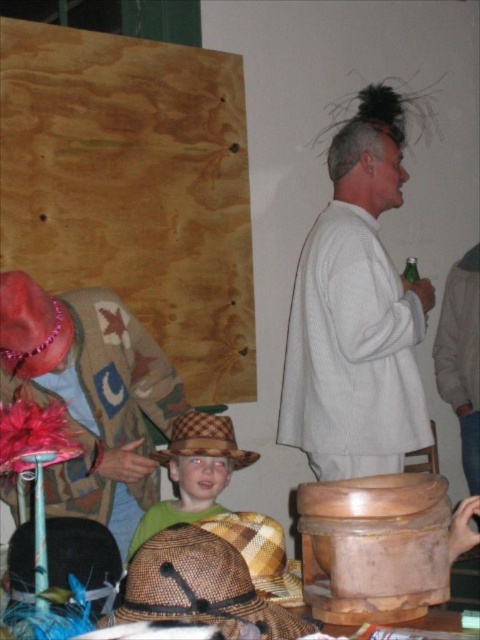
You are a fashion designer observing the image. You notice the knitted wool sweater at center and the woven straw cowboy hat at center. Which item is covering the other?

The knitted wool sweater at center is positioned over the woven straw cowboy hat at center, meaning the sweater is covering the hat.